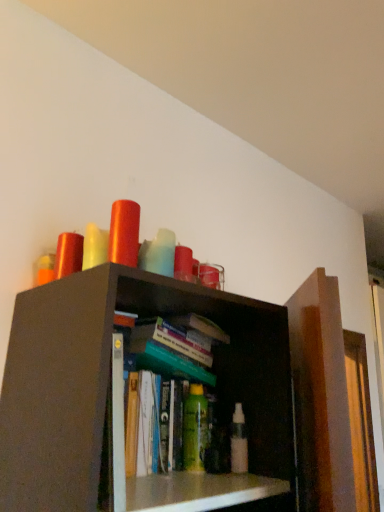
Question: Is white plastic spray bottle at center, which is counted as the first toiletry, starting from the right, wider or thinner than green matte bottle at center, positioned as the first toiletry in left-to-right order?

Choices:
 (A) thin
 (B) wide

Answer: (A)

Question: Is white plastic spray bottle at center, which is counted as the first toiletry, starting from the right, bigger or smaller than green matte bottle at center, the second toiletry in the right-to-left sequence?

Choices:
 (A) small
 (B) big

Answer: (A)

Question: From the image's perspective, is white plastic spray bottle at center, placed as the 2th toiletry when sorted from left to right, located above or below green matte bottle at center, the second toiletry in the right-to-left sequence?

Choices:
 (A) above
 (B) below

Answer: (B)

Question: Is green matte bottle at center, the second toiletry in the right-to-left sequence, taller or shorter than white plastic spray bottle at center, which is counted as the first toiletry, starting from the right?

Choices:
 (A) short
 (B) tall

Answer: (B)

Question: Considering their positions, is green matte bottle at center, positioned as the first toiletry in left-to-right order, located in front of or behind white plastic spray bottle at center, which is counted as the first toiletry, starting from the right?

Choices:
 (A) front
 (B) behind

Answer: (B)

Question: Considering the positions of green matte bottle at center, positioned as the first toiletry in left-to-right order, and white plastic spray bottle at center, which is counted as the first toiletry, starting from the right, in the image, is green matte bottle at center, positioned as the first toiletry in left-to-right order, wider or thinner than white plastic spray bottle at center, which is counted as the first toiletry, starting from the right,?

Choices:
 (A) wide
 (B) thin

Answer: (A)

Question: Is green matte bottle at center, the second toiletry in the right-to-left sequence, inside the boundaries of white plastic spray bottle at center, placed as the 2th toiletry when sorted from left to right, or outside?

Choices:
 (A) outside
 (B) inside

Answer: (A)